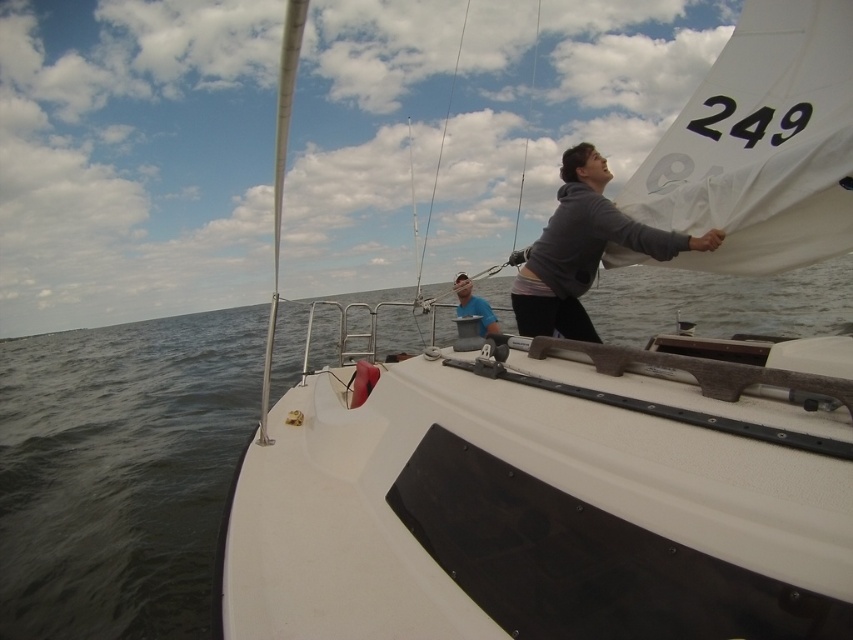
You are a sailor standing on the deck of the white matte sailboat at center. You need to retrieve the blue fabric bucket at center to bail out some water. Can you reach it without moving from your current position?

The distance between the white matte sailboat at center and the blue fabric bucket at center is 2.28 meters. Since the average human arm reach is about 1.5 meters, you cannot reach the blue fabric bucket at center without moving.

You are navigating a drone to capture aerial footage of the white matte sailboat at center. According to the coordinates provided, where should you position the drone relative to the sailboat for optimal framing?

The white matte sailboat at center is located at coordinates point (549, 492), so positioning the drone directly above this point will ensure optimal framing.